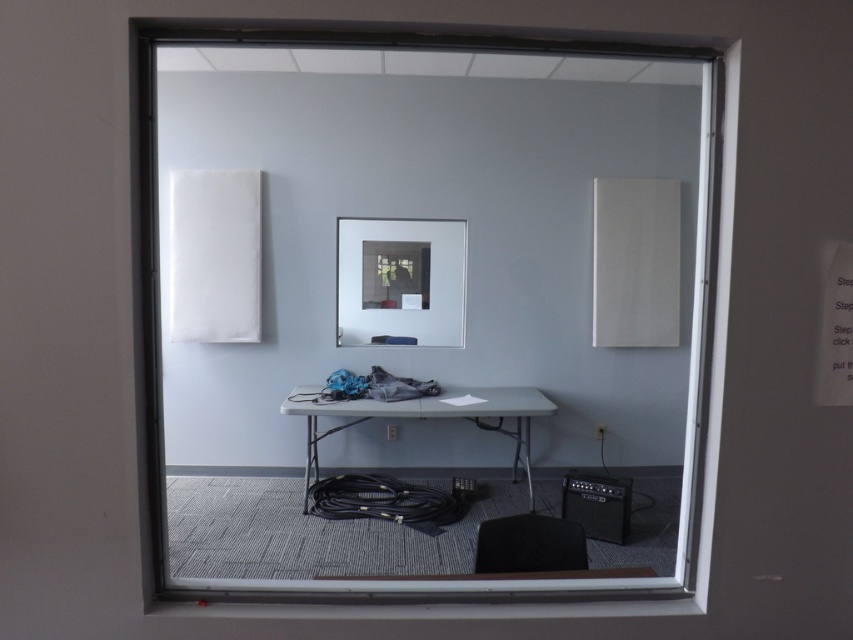
Question: From the image, what is the correct spatial relationship of transparent glass window at center in relation to white plastic table at center?

Choices:
 (A) right
 (B) left

Answer: (A)

Question: Which object appears closest to the camera in this image?

Choices:
 (A) transparent glass window at center
 (B) clear glass mirror at center
 (C) white plastic table at center
 (D) black plastic plug at lower center

Answer: (A)

Question: Which of the following is the farthest from the observer?

Choices:
 (A) clear glass mirror at center
 (B) white plastic table at center
 (C) transparent glass window at center

Answer: (A)

Question: Does white plastic table at center appear over black plastic plug at lower center?

Choices:
 (A) no
 (B) yes

Answer: (B)

Question: Can you confirm if metallic gray plug at center is positioned to the left of black plastic plug at lower center?

Choices:
 (A) yes
 (B) no

Answer: (A)

Question: Estimate the real-world distances between objects in this image. Which object is closer to the transparent glass window at center?

Choices:
 (A) black plastic plug at lower center
 (B) clear glass mirror at center
 (C) white plastic table at center
 (D) metallic gray plug at center

Answer: (B)